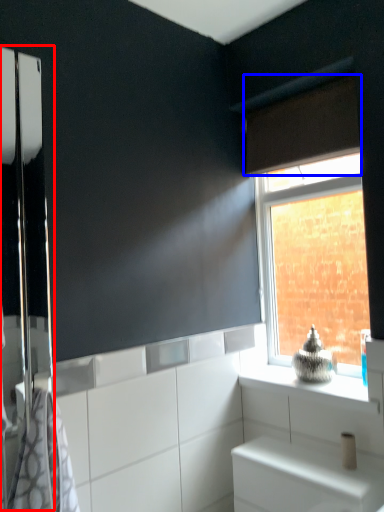
Question: Which object appears farthest to the camera in this image, screen door (highlighted by a red box) or curtain (highlighted by a blue box)?

Choices:
 (A) screen door
 (B) curtain

Answer: (B)